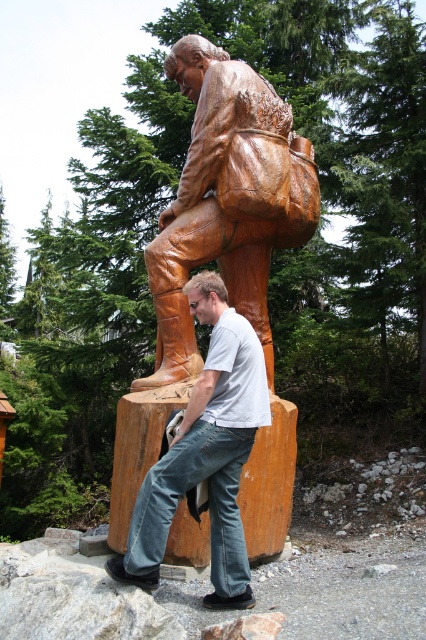
Question: Does wooden carved figure at center come in front of natural wood log at center?

Choices:
 (A) no
 (B) yes

Answer: (A)

Question: Among these points, which one is farthest from the camera?

Choices:
 (A) (278, 460)
 (B) (227, 182)

Answer: (B)

Question: Which point is farther to the camera?

Choices:
 (A) wooden carved figure at center
 (B) natural wood log at center

Answer: (A)

Question: Can you confirm if wooden carved figure at center is positioned below natural wood log at center?

Choices:
 (A) yes
 (B) no

Answer: (B)

Question: Is wooden carved figure at center wider than matte brown boot at center?

Choices:
 (A) yes
 (B) no

Answer: (A)

Question: Estimate the real-world distances between objects in this image. Which object is farther from the wooden carved figure at center?

Choices:
 (A) natural wood log at center
 (B) matte brown boot at center

Answer: (A)